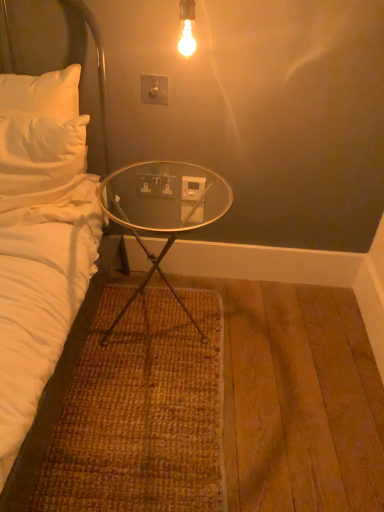
Question: Is white plastic power outlet at center located outside white plastic electric outlet at center, which appears as the 1th electric outlet when viewed from the back?

Choices:
 (A) yes
 (B) no

Answer: (A)

Question: From a real-world perspective, is white plastic power outlet at center physically below white plastic electric outlet at center, which is the second electric outlet in front-to-back order?

Choices:
 (A) no
 (B) yes

Answer: (A)

Question: Can you confirm if white plastic power outlet at center is shorter than white plastic electric outlet at center, which appears as the 1th electric outlet when viewed from the back?

Choices:
 (A) yes
 (B) no

Answer: (B)

Question: Does white plastic power outlet at center have a smaller size compared to white plastic electric outlet at center, which is the second electric outlet in front-to-back order?

Choices:
 (A) no
 (B) yes

Answer: (A)

Question: Is white plastic power outlet at center facing away from white plastic electric outlet at center, positioned as the 1th electric outlet in bottom-to-top order?

Choices:
 (A) yes
 (B) no

Answer: (B)

Question: Considering their positions, is white soft bed at left located in front of or behind white plastic electric outlet at center, marked as the 2th electric outlet in a top-to-bottom arrangement?

Choices:
 (A) front
 (B) behind

Answer: (A)

Question: Considering the relative positions of white soft bed at left and white plastic electric outlet at center, which is the second electric outlet in front-to-back order, in the image provided, is white soft bed at left to the left or to the right of white plastic electric outlet at center, which is the second electric outlet in front-to-back order,?

Choices:
 (A) right
 (B) left

Answer: (B)

Question: From a real-world perspective, is white soft bed at left positioned above or below white plastic electric outlet at center, positioned as the 1th electric outlet in bottom-to-top order?

Choices:
 (A) below
 (B) above

Answer: (B)

Question: Looking at their shapes, would you say white soft bed at left is wider or thinner than white plastic electric outlet at center, which appears as the 1th electric outlet when viewed from the back?

Choices:
 (A) wide
 (B) thin

Answer: (A)

Question: From a real-world perspective, relative to white plastic electric outlet at center, marked as the 2th electric outlet in a top-to-bottom arrangement, is white plastic switch at upper center, placed as the 2th electric outlet when sorted from bottom to top, vertically above or below?

Choices:
 (A) below
 (B) above

Answer: (B)

Question: Is point (142, 100) closer or farther from the camera than point (147, 194)?

Choices:
 (A) farther
 (B) closer

Answer: (B)

Question: In terms of height, does white plastic switch at upper center, placed as the 2th electric outlet when sorted from bottom to top, look taller or shorter compared to white plastic electric outlet at center, positioned as the 1th electric outlet in bottom-to-top order?

Choices:
 (A) tall
 (B) short

Answer: (A)

Question: Which is correct: white plastic switch at upper center, placed as the 2th electric outlet when sorted from bottom to top, is inside white plastic electric outlet at center, marked as the 2th electric outlet in a top-to-bottom arrangement, or outside of it?

Choices:
 (A) outside
 (B) inside

Answer: (A)

Question: Considering the positions of point (125, 192) and point (150, 177), is point (125, 192) closer or farther from the camera than point (150, 177)?

Choices:
 (A) closer
 (B) farther

Answer: (B)

Question: Would you say transparent glass table at center is to the left or to the right of white plastic electric outlet at center, which is the second electric outlet in front-to-back order, in the picture?

Choices:
 (A) left
 (B) right

Answer: (B)